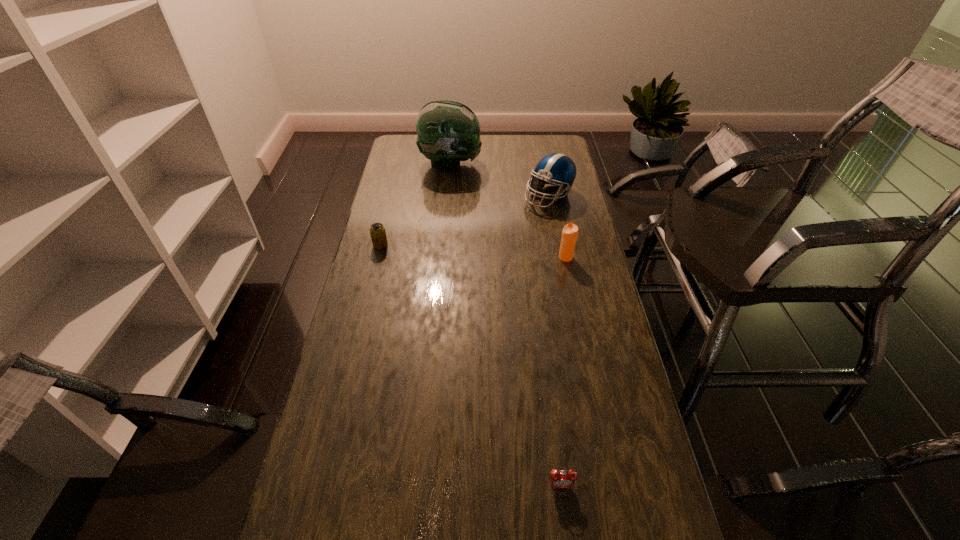
At what (x,y) coordinates should I click in order to perform the action: click on free spot between the right football helmet and the second nearest object. Please return your answer as a coordinate pair (x, y). Looking at the image, I should click on (558, 227).

Locate an element on the screen. This screenshot has width=960, height=540. vacant space in between the taller football helmet and the nearest object is located at coordinates (506, 325).

The image size is (960, 540). Find the location of `empty space between the nearest object and the fourth farthest object`. empty space between the nearest object and the fourth farthest object is located at coordinates (564, 372).

Select which object is the third closest to the right football helmet. Please provide its 2D coordinates. Your answer should be formatted as a tuple, i.e. [(x, y)], where the tuple contains the x and y coordinates of a point satisfying the conditions above.

[(377, 231)]

Select which object appears as the third closest to the tallest object. Please provide its 2D coordinates. Your answer should be formatted as a tuple, i.e. [(x, y)], where the tuple contains the x and y coordinates of a point satisfying the conditions above.

[(570, 231)]

At what (x,y) coordinates should I click in order to perform the action: click on vacant region that satisfies the following two spatial constraints: 1. on the visor of the left football helmet; 2. on the back side of the second nearest object. Please return your answer as a coordinate pair (x, y). The width and height of the screenshot is (960, 540). Looking at the image, I should click on (442, 258).

The width and height of the screenshot is (960, 540). In order to click on vacant region that satisfies the following two spatial constraints: 1. on the visor of the farthest object; 2. on the left side of the candle in this screenshot , I will do `click(442, 258)`.

The image size is (960, 540). Find the location of `vacant area that satisfies the following two spatial constraints: 1. at the front of the fourth nearest object with the faceguard; 2. on the right side of the candle`. vacant area that satisfies the following two spatial constraints: 1. at the front of the fourth nearest object with the faceguard; 2. on the right side of the candle is located at coordinates click(x=561, y=258).

Find the location of a particular element. free space that satisfies the following two spatial constraints: 1. on the visor of the farther football helmet; 2. on the front side of the leftmost object is located at coordinates (444, 245).

Where is `blank space that satisfies the following two spatial constraints: 1. on the visor of the fourth farthest object; 2. on the left side of the farther football helmet`? The height and width of the screenshot is (540, 960). blank space that satisfies the following two spatial constraints: 1. on the visor of the fourth farthest object; 2. on the left side of the farther football helmet is located at coordinates (442, 258).